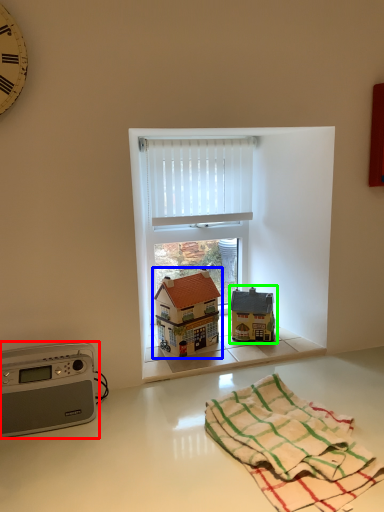
Question: Considering the real-world distances, which object is farthest from appliance (highlighted by a red box)? toy (highlighted by a blue box) or toy (highlighted by a green box)?

Choices:
 (A) toy
 (B) toy

Answer: (B)